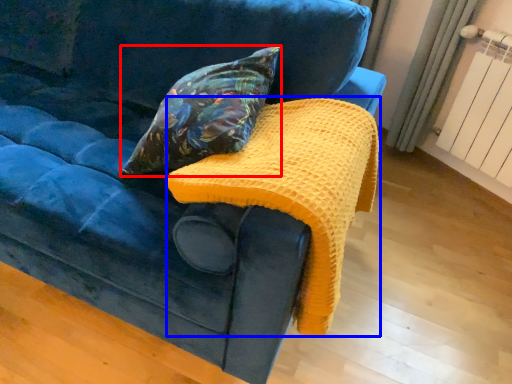
Question: Which point is closer to the camera, pillow (highlighted by a red box) or blanket (highlighted by a blue box)?

Choices:
 (A) pillow
 (B) blanket

Answer: (B)